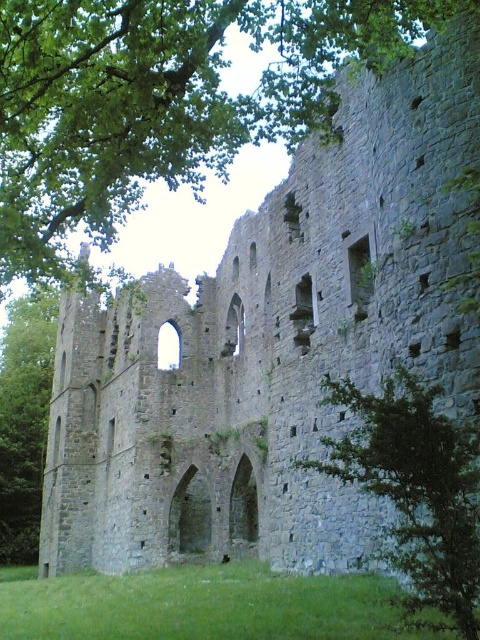
The image size is (480, 640). Describe the element at coordinates (160, 100) in the screenshot. I see `green leafy tree at upper center` at that location.

Which is in front, point (69, 3) or point (392, 566)?

Point (69, 3)

Which is in front, point (160, 12) or point (432, 451)?

Positioned in front is point (432, 451).

The width and height of the screenshot is (480, 640). Find the location of `green leafy tree at upper center`. green leafy tree at upper center is located at coordinates (160, 100).